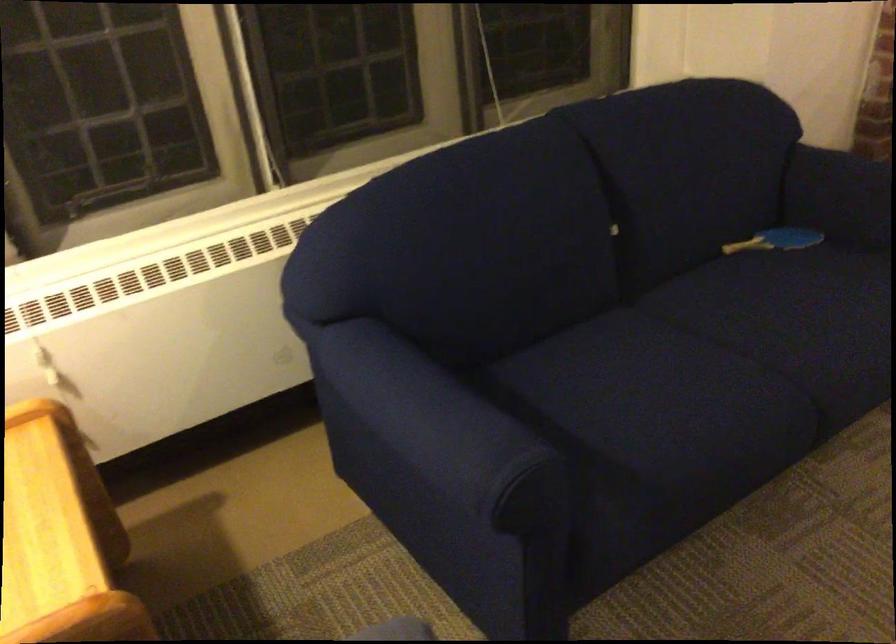
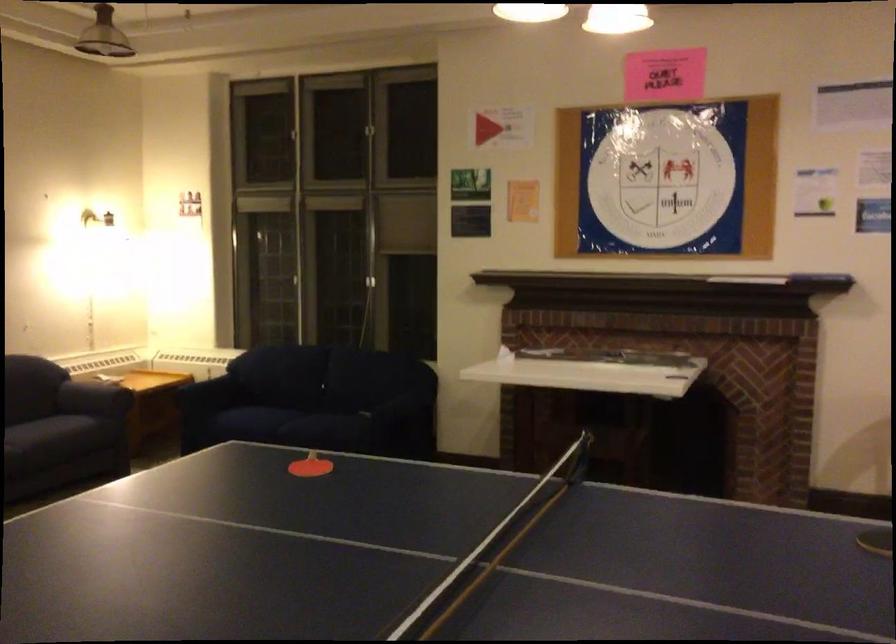
In the second image, find the point that corresponds to pixel 670 406 in the first image.

(271, 424)